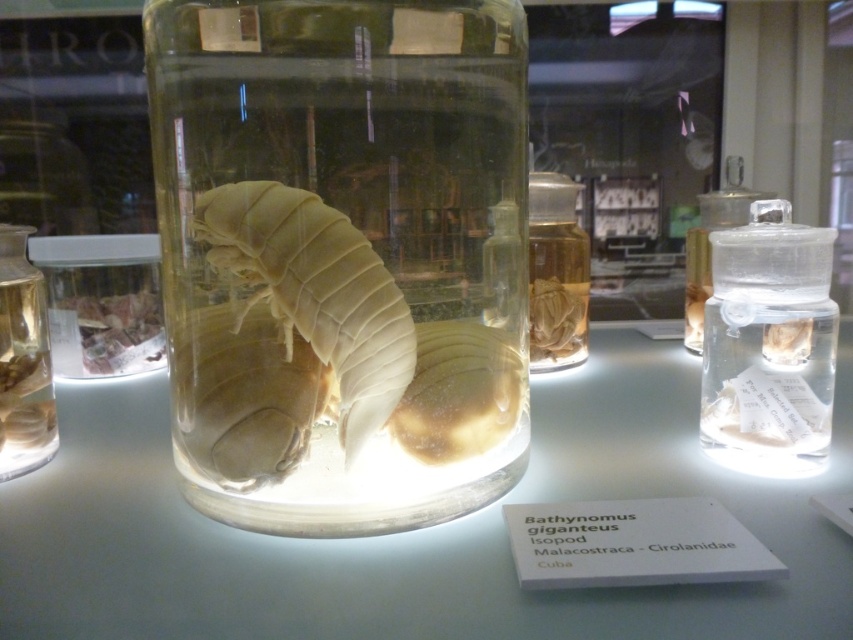
Question: Which object is closer to the camera taking this photo?

Choices:
 (A) translucent white isopod at center
 (B) clear glass jar at right
 (C) transparent plastic bottle at upper right

Answer: (A)

Question: Which object appears closest to the camera in this image?

Choices:
 (A) transparent glass table at center
 (B) transparent glass jar at center
 (C) clear glass jar at left

Answer: (A)

Question: Does transparent glass jar at center appear on the left side of clear glass jar at right?

Choices:
 (A) no
 (B) yes

Answer: (B)

Question: Is transparent glass table at center below clear glass jar at right?

Choices:
 (A) no
 (B) yes

Answer: (B)

Question: Where is transparent glass table at center located in relation to translucent white isopod at center in the image?

Choices:
 (A) above
 (B) below

Answer: (B)

Question: Which object is farther from the camera taking this photo?

Choices:
 (A) translucent white isopod at center
 (B) transparent plastic bottle at upper right

Answer: (B)